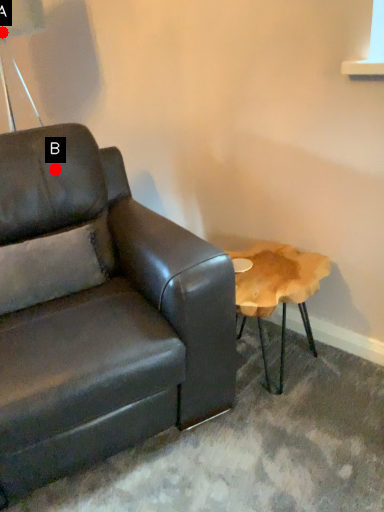
Question: Two points are circled on the image, labeled by A and B beside each circle. Which point is closer to the camera?

Choices:
 (A) A is closer
 (B) B is closer

Answer: (A)